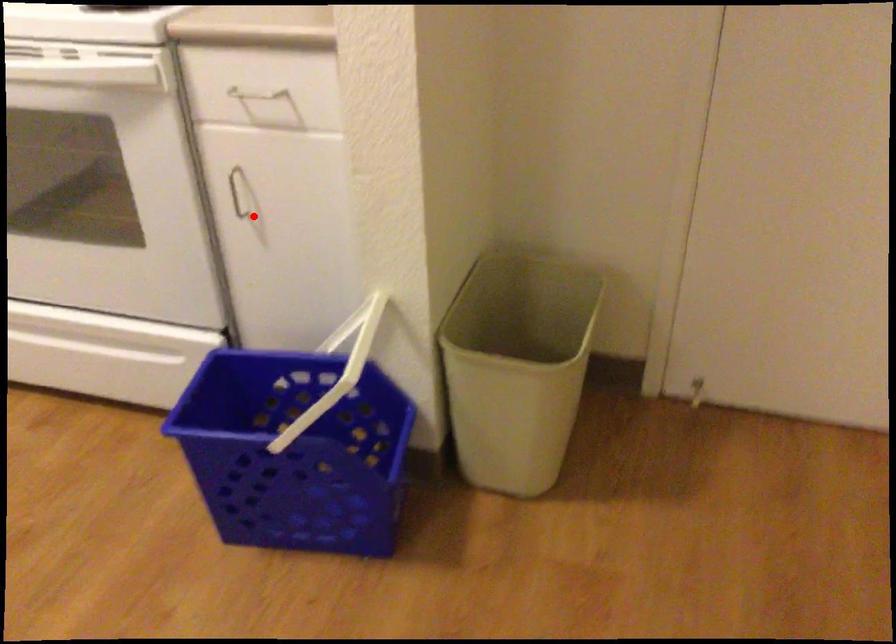
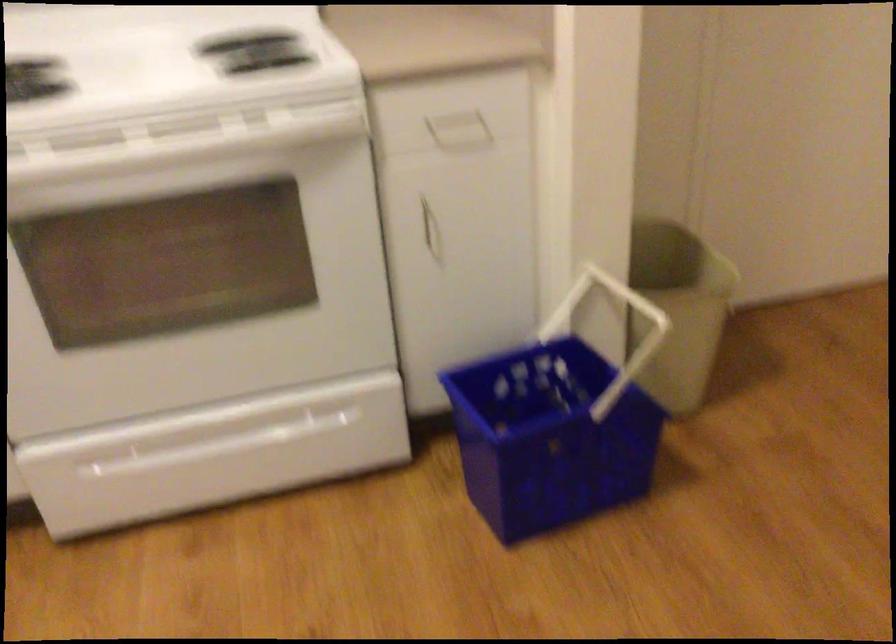
Where in the second image is the point corresponding to the highlighted location from the first image?

(431, 234)